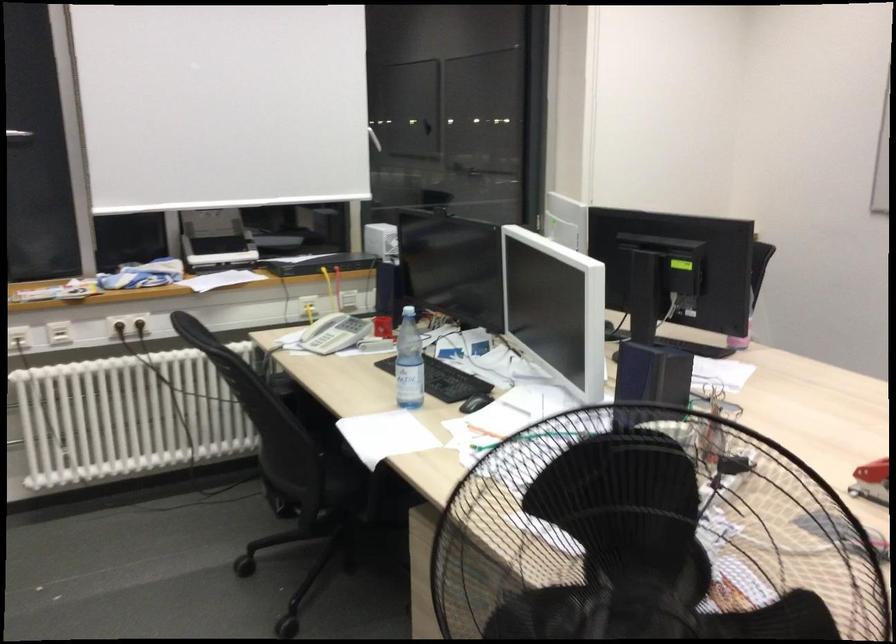
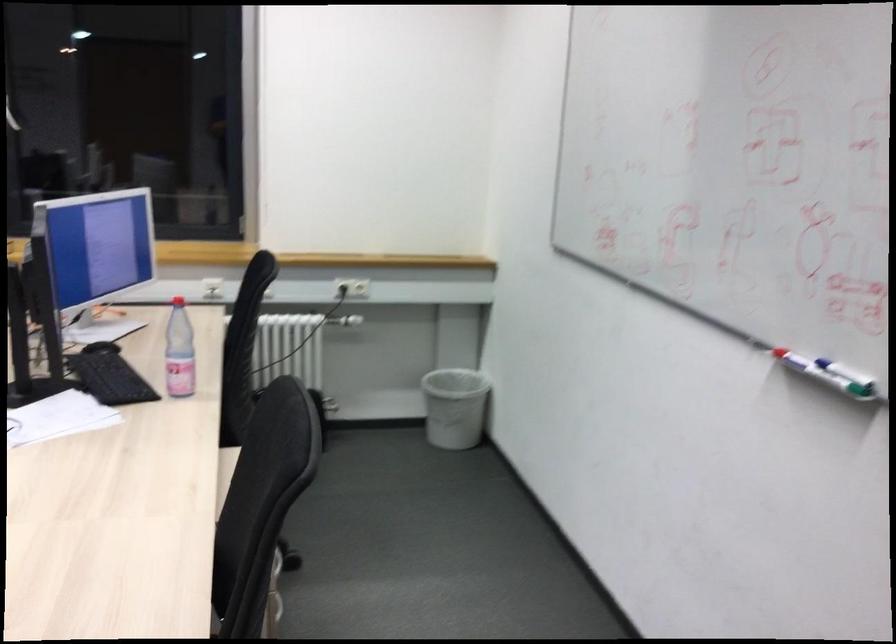
The point at (757,286) is marked in the first image. Where is the corresponding point in the second image?

(246, 319)